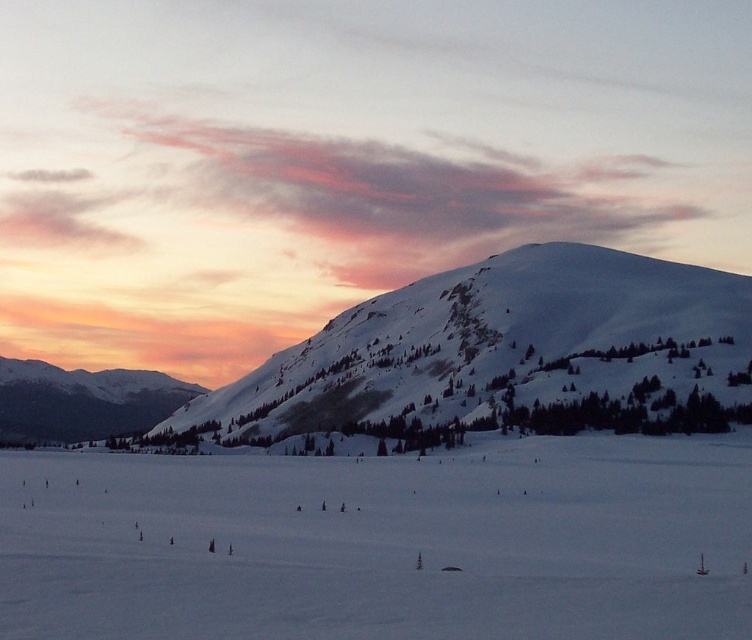
In the scene shown: Who is lower down, white smooth snow at center or snowy mountain at left?

snowy mountain at left

I want to click on white smooth snow at center, so click(x=381, y=544).

Identify the location of white smooth snow at center. The width and height of the screenshot is (752, 640). (381, 544).

Is white smooth snow at center behind white snow-covered mountain at center?

No, white smooth snow at center is in front of white snow-covered mountain at center.

Can you confirm if white smooth snow at center is bigger than white snow-covered mountain at center?

Incorrect, white smooth snow at center is not larger than white snow-covered mountain at center.

The width and height of the screenshot is (752, 640). What do you see at coordinates (381, 544) in the screenshot?
I see `white smooth snow at center` at bounding box center [381, 544].

Locate an element on the screen. This screenshot has width=752, height=640. white smooth snow at center is located at coordinates (381, 544).

Is point (626, 396) farther from viewer compared to point (17, 385)?

No, (626, 396) is in front of (17, 385).

Between white snow-covered mountain at center and snowy mountain at left, which one appears on the right side from the viewer's perspective?

From the viewer's perspective, white snow-covered mountain at center appears more on the right side.

What do you see at coordinates (505, 356) in the screenshot?
I see `white snow-covered mountain at center` at bounding box center [505, 356].

This screenshot has width=752, height=640. Identify the location of white snow-covered mountain at center. (505, 356).